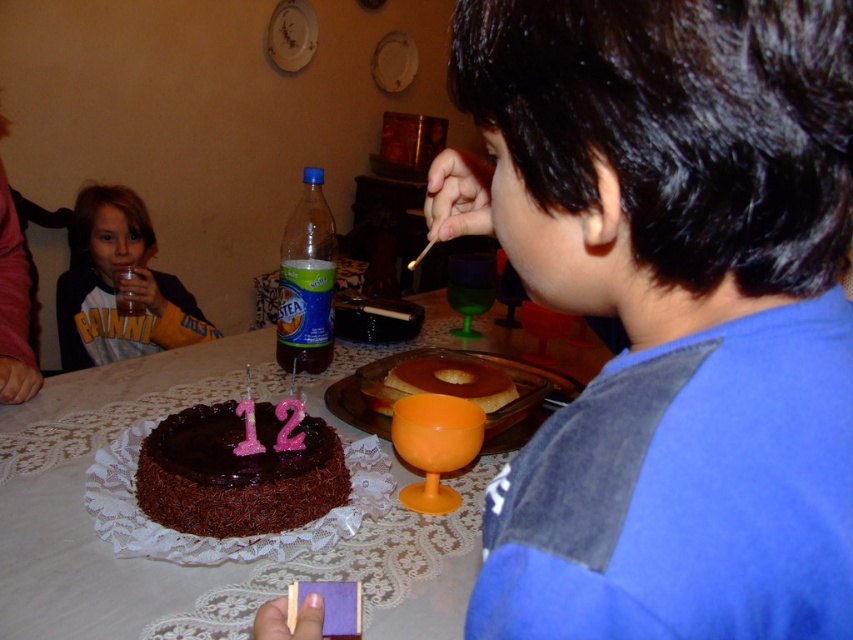
Which is below, white lace tablecloth at center or chocolatesmoothcake at lower center?

Positioned lower is chocolatesmoothcake at lower center.

Is point (85, 509) positioned before point (305, 500)?

No, it is not.

At what (x,y) coordinates should I click in order to perform the action: click on white lace tablecloth at center. Please return your answer as a coordinate pair (x, y). This screenshot has width=853, height=640. Looking at the image, I should click on (85, 509).

Who is taller, blue cotton shirt at right or matte yellow shirt at left?

matte yellow shirt at left

Between blue cotton shirt at right and matte yellow shirt at left, which one appears on the left side from the viewer's perspective?

matte yellow shirt at left is more to the left.

The height and width of the screenshot is (640, 853). Find the location of `blue cotton shirt at right`. blue cotton shirt at right is located at coordinates (669, 308).

This screenshot has width=853, height=640. What are the coordinates of `blue cotton shirt at right` in the screenshot? It's located at (669, 308).

Does white lace tablecloth at center have a lesser height compared to golden caramel flan at center?

In fact, white lace tablecloth at center may be taller than golden caramel flan at center.

How distant is white lace tablecloth at center from golden caramel flan at center?

They are 8.33 inches apart.

Who is more distant from viewer, (51, 592) or (413, 371)?

The point (413, 371) is more distant.

You are a GUI agent. You are given a task and a screenshot of the screen. Output one action in this format:
    pyautogui.click(x=<x>, y=<y>)
    Task: Click on the white lace tablecloth at center
    Image resolution: width=853 pixels, height=640 pixels.
    Given the screenshot: What is the action you would take?
    pyautogui.click(x=85, y=509)